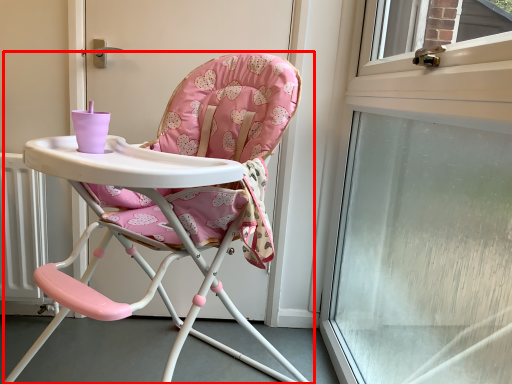
Question: From the image's perspective, where is chair (annotated by the red box) located relative to window?

Choices:
 (A) above
 (B) below

Answer: (B)